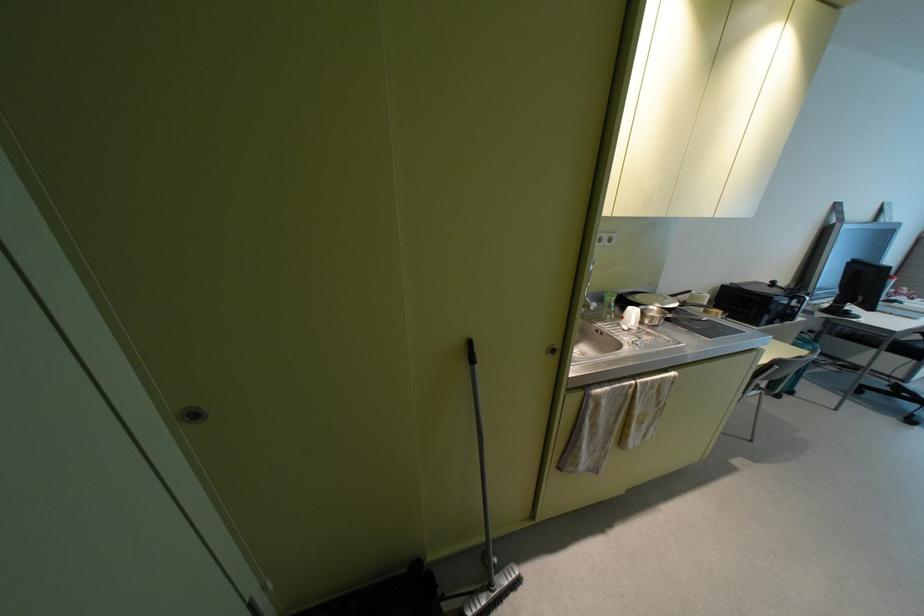
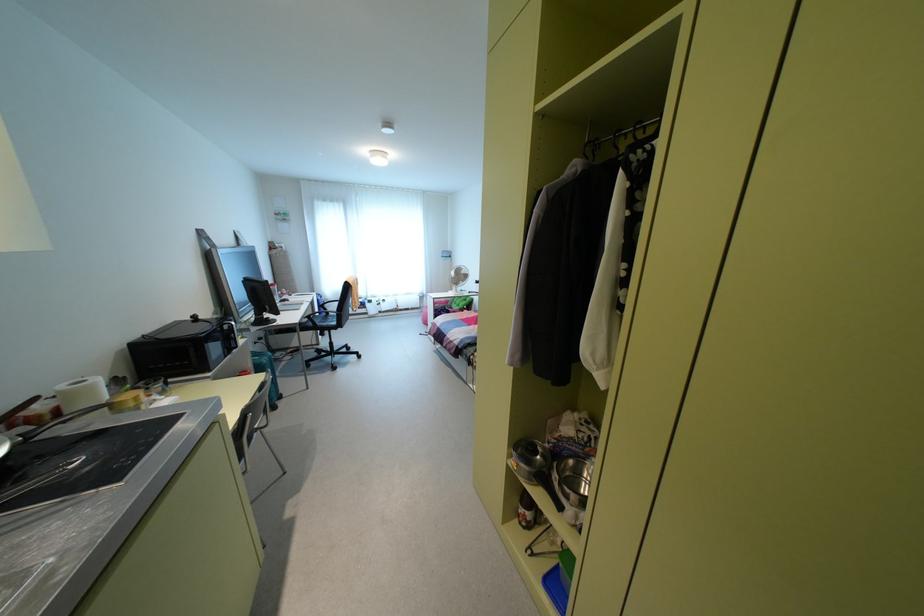
Locate, in the second image, the point that corresponds to point (785, 317) in the first image.

(229, 346)